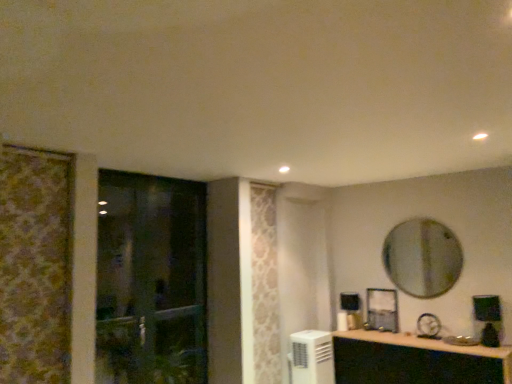
Question: Considering the relative sizes of white plastic air conditioner at lower center and silver metallic mirror at upper right in the image provided, is white plastic air conditioner at lower center wider than silver metallic mirror at upper right?

Choices:
 (A) no
 (B) yes

Answer: (B)

Question: Considering the relative positions of white plastic air conditioner at lower center and silver metallic mirror at upper right in the image provided, is white plastic air conditioner at lower center to the left of silver metallic mirror at upper right from the viewer's perspective?

Choices:
 (A) no
 (B) yes

Answer: (B)

Question: From a real-world perspective, is white plastic air conditioner at lower center on silver metallic mirror at upper right?

Choices:
 (A) no
 (B) yes

Answer: (A)

Question: From the image's perspective, would you say white plastic air conditioner at lower center is positioned over silver metallic mirror at upper right?

Choices:
 (A) no
 (B) yes

Answer: (A)

Question: Considering the relative sizes of white plastic air conditioner at lower center and silver metallic mirror at upper right in the image provided, is white plastic air conditioner at lower center bigger than silver metallic mirror at upper right?

Choices:
 (A) no
 (B) yes

Answer: (B)

Question: Can you confirm if white plastic air conditioner at lower center is taller than silver metallic mirror at upper right?

Choices:
 (A) no
 (B) yes

Answer: (A)

Question: Can you confirm if matte black cabinet at lower right is shorter than silver metallic mirror at upper right?

Choices:
 (A) yes
 (B) no

Answer: (A)

Question: Is matte black cabinet at lower right to the left of silver metallic mirror at upper right from the viewer's perspective?

Choices:
 (A) yes
 (B) no

Answer: (A)

Question: Is matte black cabinet at lower right oriented towards silver metallic mirror at upper right?

Choices:
 (A) yes
 (B) no

Answer: (B)

Question: Considering the relative sizes of matte black cabinet at lower right and silver metallic mirror at upper right in the image provided, is matte black cabinet at lower right smaller than silver metallic mirror at upper right?

Choices:
 (A) yes
 (B) no

Answer: (B)

Question: From the image's perspective, is matte black cabinet at lower right located beneath silver metallic mirror at upper right?

Choices:
 (A) no
 (B) yes

Answer: (B)

Question: From the image's perspective, is matte black cabinet at lower right on top of silver metallic mirror at upper right?

Choices:
 (A) no
 (B) yes

Answer: (A)

Question: From a real-world perspective, is matte black cabinet at lower right physically below white plastic air conditioner at lower center?

Choices:
 (A) no
 (B) yes

Answer: (B)